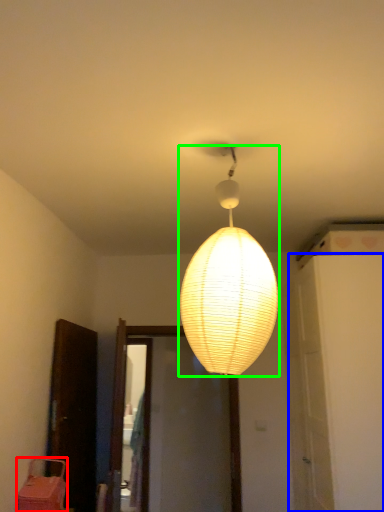
Question: Which object is the farthest from furniture (highlighted by a red box)? Choose among these: door (highlighted by a blue box) or lamp (highlighted by a green box).

Choices:
 (A) door
 (B) lamp

Answer: (A)